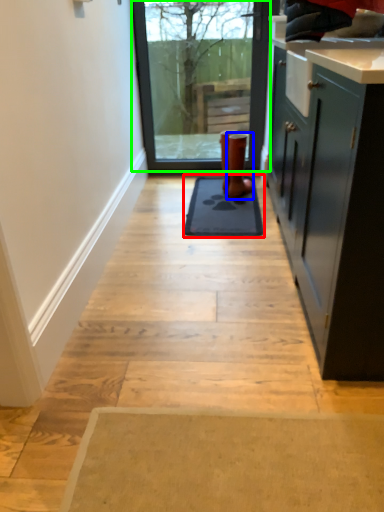
Question: Which object is the farthest from mat (highlighted by a red box)? Choose among these: footwear (highlighted by a blue box) or window (highlighted by a green box).

Choices:
 (A) footwear
 (B) window

Answer: (B)